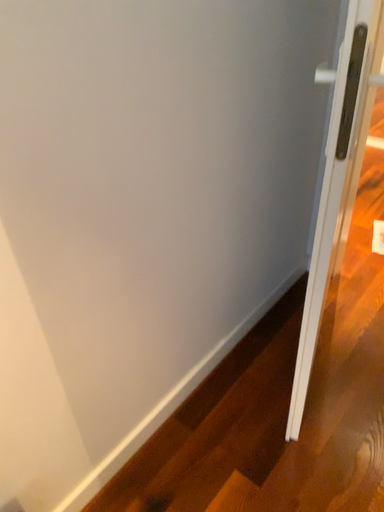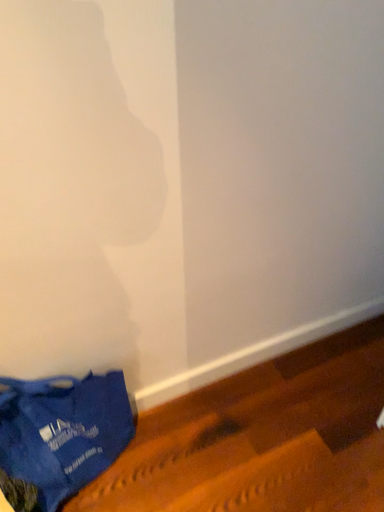
Question: Which way did the camera rotate in the video?

Choices:
 (A) rotated right
 (B) rotated left

Answer: (B)